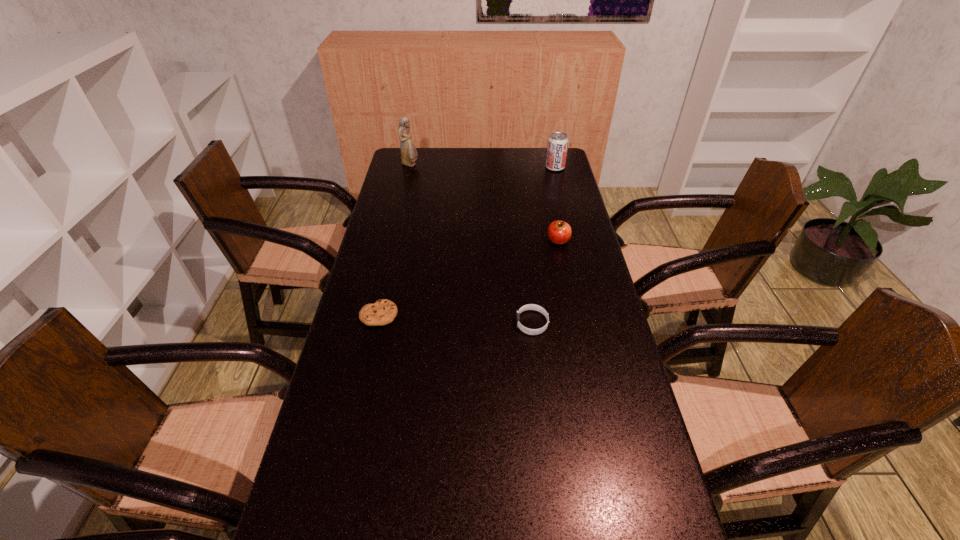
Where is `object that is at the far left corner`? Image resolution: width=960 pixels, height=540 pixels. object that is at the far left corner is located at coordinates (409, 154).

The image size is (960, 540). What are the coordinates of `object that is at the far right corner` in the screenshot? It's located at (557, 147).

Image resolution: width=960 pixels, height=540 pixels. In the image, there is a desktop. Identify the location of free region at the far edge. tap(518, 169).

You are a GUI agent. You are given a task and a screenshot of the screen. Output one action in this format:
    pyautogui.click(x=<x>, y=<y>)
    Task: Click on the vacant region at the left edge of the desktop
    This screenshot has width=960, height=540.
    Given the screenshot: What is the action you would take?
    pyautogui.click(x=381, y=392)

Locate an element on the screen. Image resolution: width=960 pixels, height=540 pixels. vacant region at the right edge is located at coordinates (629, 433).

Image resolution: width=960 pixels, height=540 pixels. I want to click on free space between the figurine and the soda can, so click(483, 166).

Where is `vacant area between the third nearest object and the tallest object`? vacant area between the third nearest object and the tallest object is located at coordinates (484, 202).

Where is `free space that is in between the second tallest object and the third object from right to left`? The image size is (960, 540). free space that is in between the second tallest object and the third object from right to left is located at coordinates (543, 245).

Image resolution: width=960 pixels, height=540 pixels. I want to click on vacant space that is in between the shortest object and the tallest object, so [x=395, y=240].

At what (x,y) coordinates should I click in order to perform the action: click on vacant region between the third nearest object and the soda can. Please return your answer as a coordinate pair (x, y). Looking at the image, I should click on (557, 204).